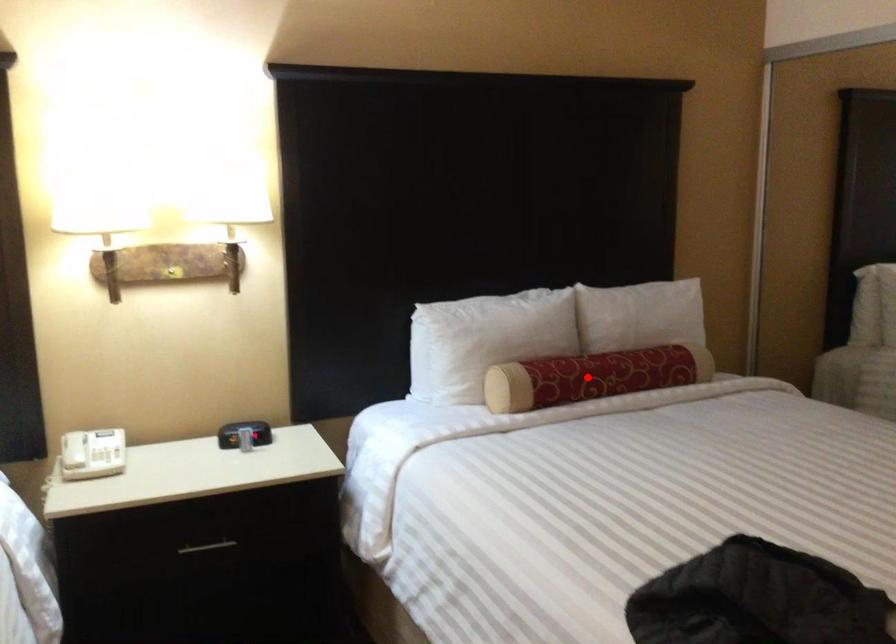
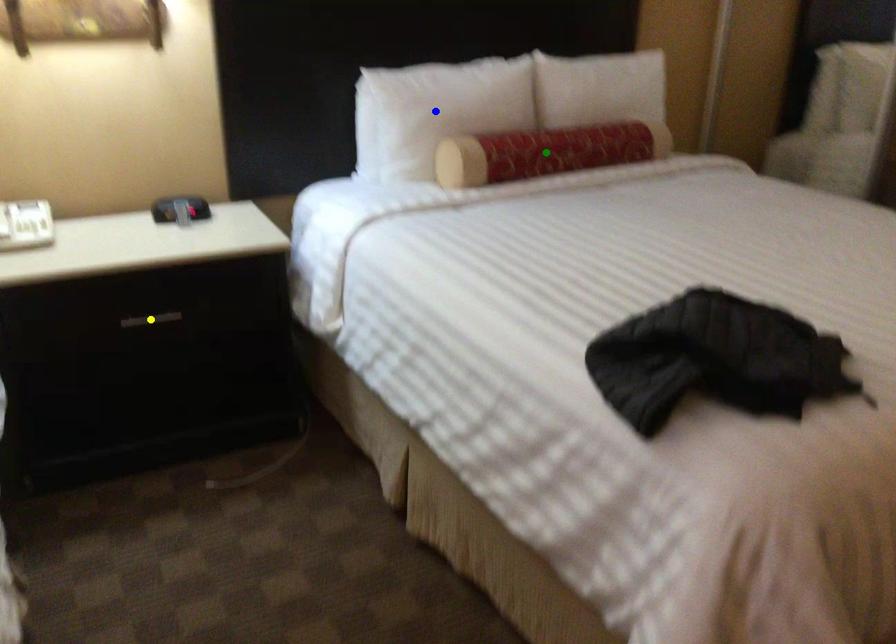
Question: I am providing you with two images of the same scene from different viewpoints. A red point is marked on the first image. You are given multiple points on the second image. In image 2, which mark is for the same physical point as the one in image 1?

Choices:
 (A) green point
 (B) yellow point
 (C) blue point

Answer: (A)